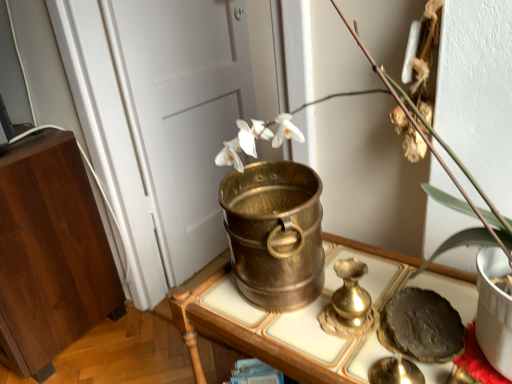
In order to click on unoccupied area behind shiny dark plate at lower right in this screenshot , I will do `click(388, 272)`.